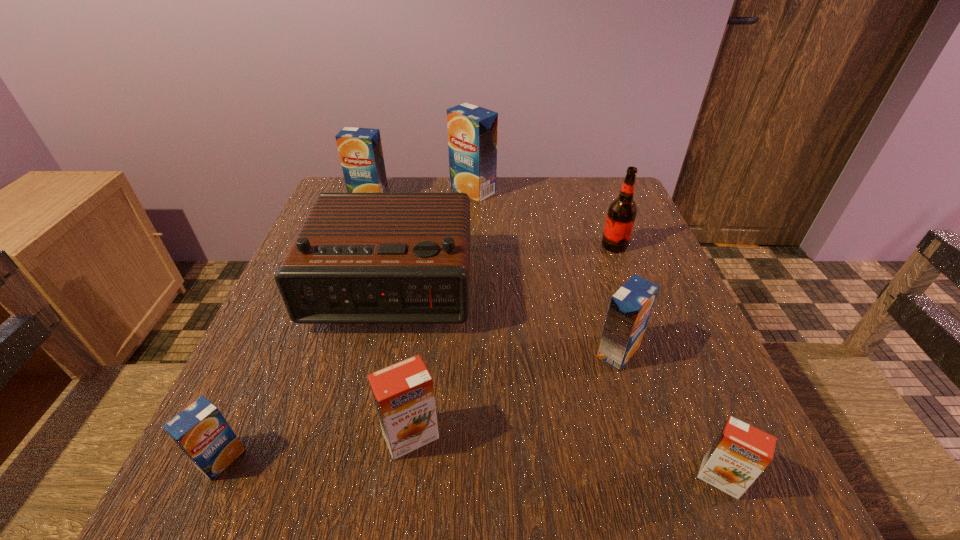
At what (x,y) coordinates should I click in order to perform the action: click on the third blue orange_juice from left to right. Please return your answer as a coordinate pair (x, y). The image size is (960, 540). Looking at the image, I should click on (472, 130).

This screenshot has width=960, height=540. What are the coordinates of `the tallest orange juice` in the screenshot? It's located at (472, 130).

What are the coordinates of `root beer` in the screenshot? It's located at (621, 215).

Where is `the second biggest blue orange_juice`? the second biggest blue orange_juice is located at coordinates (360, 149).

Where is `radio receiver`? radio receiver is located at coordinates (358, 258).

This screenshot has height=540, width=960. Identify the location of the second smallest blue orange_juice. (630, 308).

The image size is (960, 540). What are the coordinates of `the fifth orange juice from left to right` in the screenshot? It's located at (630, 308).

The width and height of the screenshot is (960, 540). Find the location of `the left orange orange juice`. the left orange orange juice is located at coordinates (403, 393).

The height and width of the screenshot is (540, 960). What are the coordinates of `the nearest blue orange_juice` in the screenshot? It's located at (200, 430).

Identify the location of the rightmost orange juice. (740, 452).